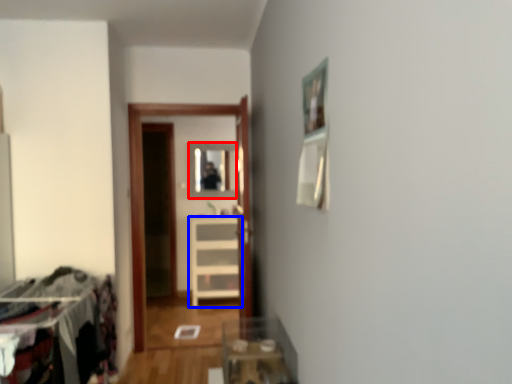
Question: Which point is further to the camera, mirror (highlighted by a red box) or furniture (highlighted by a blue box)?

Choices:
 (A) mirror
 (B) furniture

Answer: (A)